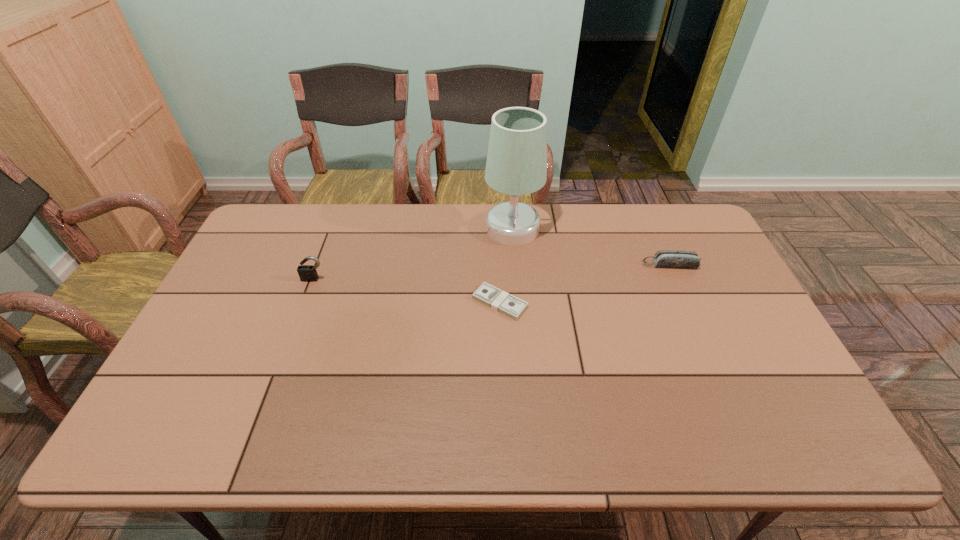
This screenshot has width=960, height=540. Find the location of `unoccupied area between the nearest object and the third tallest object`. unoccupied area between the nearest object and the third tallest object is located at coordinates (585, 284).

You are a GUI agent. You are given a task and a screenshot of the screen. Output one action in this format:
    pyautogui.click(x=<x>, y=<y>)
    Task: Click on the unoccupied position between the dollar and the farthest object
    This screenshot has height=540, width=960.
    Given the screenshot: What is the action you would take?
    pyautogui.click(x=506, y=266)

Locate an element on the screen. Image resolution: width=960 pixels, height=540 pixels. object that is the closest to the second farthest object is located at coordinates (516, 161).

This screenshot has width=960, height=540. Identify the location of object that ranks as the third closest to the rightmost object. (307, 273).

Where is `free region that satisfies the following two spatial constraints: 1. on the back side of the rightmost object; 2. on the base of the tallest object`? The height and width of the screenshot is (540, 960). free region that satisfies the following two spatial constraints: 1. on the back side of the rightmost object; 2. on the base of the tallest object is located at coordinates (654, 228).

Identify the location of free space that satisfies the following two spatial constraints: 1. on the base of the tallest object; 2. on the left side of the pencil box. The width and height of the screenshot is (960, 540). (516, 265).

At what (x,y) coordinates should I click in order to perform the action: click on free space that satisfies the following two spatial constraints: 1. on the base of the lampshade; 2. with the keyhole on the front of the third shortest object. Please return your answer as a coordinate pair (x, y). Looking at the image, I should click on (516, 279).

What are the coordinates of `vacant region that satisfies the following two spatial constraints: 1. on the back side of the nearest object; 2. on the left side of the third nearest object` in the screenshot? It's located at (x=498, y=265).

Where is `vacant space that satisfies the following two spatial constraints: 1. on the base of the farthest object; 2. on the left side of the pencil box`? The height and width of the screenshot is (540, 960). vacant space that satisfies the following two spatial constraints: 1. on the base of the farthest object; 2. on the left side of the pencil box is located at coordinates (516, 265).

Identify the location of vacant space that satisfies the following two spatial constraints: 1. on the base of the lampshade; 2. on the left side of the pencil box. (516, 265).